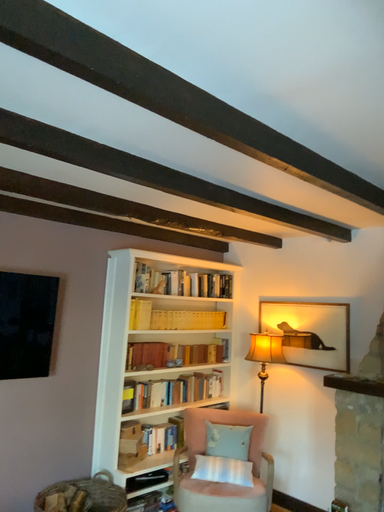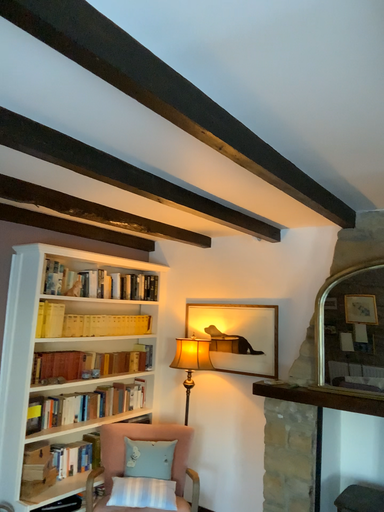
Question: How did the camera likely rotate when shooting the video?

Choices:
 (A) rotated left
 (B) rotated right

Answer: (B)